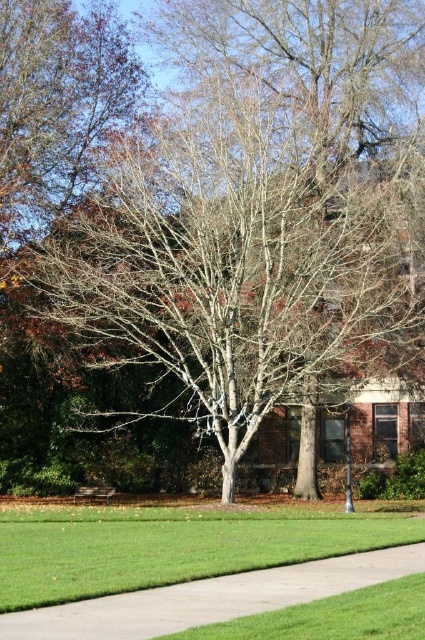
You are a gardener who needs to place a new flower pot on the gray concrete sidewalk at lower center. However, there is an existing wooden park bench at center. Can you place the flower pot on the sidewalk without it overlapping the bench?

The gray concrete sidewalk at lower center is positioned over the wooden park bench at center, meaning the sidewalk is above the bench. Therefore, placing the flower pot on the sidewalk would not overlap the bench since they are at different levels.

In the scene shown: You are a gardener who needs to place a new flower pot that is 1.2 meters wide. You see the gray concrete sidewalk at lower center and the wooden park bench at center. Which object can the flower pot fit next to without overlapping?

The wooden park bench at center is larger than the gray concrete sidewalk at lower center. Since the flower pot is 1.2 meters wide, it can fit next to the wooden park bench at center which is bigger.